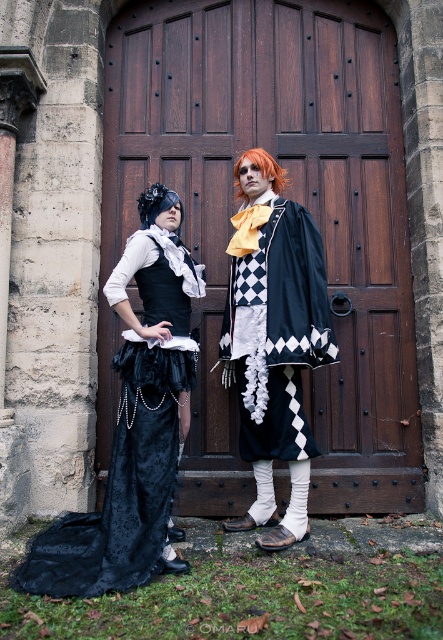
Is black velvet dress at left below black velvet coat at center?

Yes.

Between point (190, 358) and point (330, 326), which one is positioned behind?

The point (330, 326) is behind.

Locate an element on the screen. The height and width of the screenshot is (640, 443). black velvet dress at left is located at coordinates (121, 486).

Can you confirm if brown wooden door at center is bigger than black velvet coat at center?

Correct, brown wooden door at center is larger in size than black velvet coat at center.

Between point (396, 45) and point (288, 211), which one is positioned in front?

Point (288, 211)

Where is `brown wooden door at center`? This screenshot has height=640, width=443. brown wooden door at center is located at coordinates (284, 195).

Who is taller, black velvet coat at center or orange synthetic wig at center?

With more height is black velvet coat at center.

Can you confirm if black velvet coat at center is bigger than orange synthetic wig at center?

Indeed, black velvet coat at center has a larger size compared to orange synthetic wig at center.

Does point (279, 298) come behind point (252, 156)?

No, (279, 298) is in front of (252, 156).

Find the location of a particular element. black velvet coat at center is located at coordinates (295, 289).